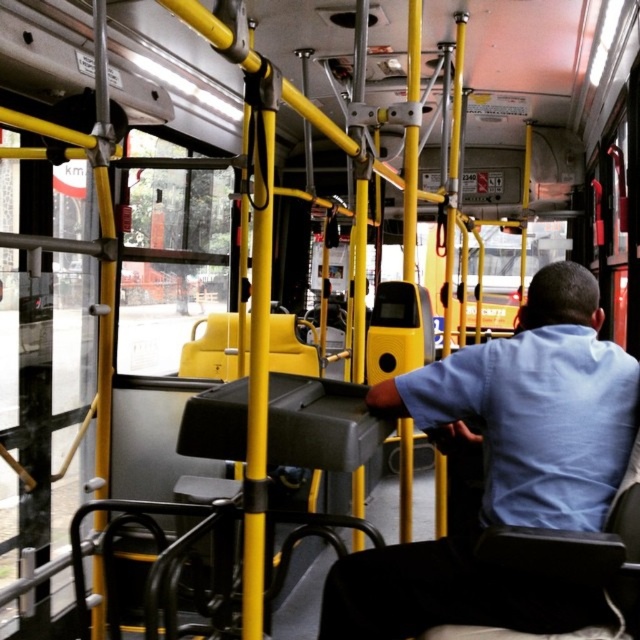
Question: Does blue cotton shirt at center appear on the right side of light blue cotton shirt at center?

Choices:
 (A) no
 (B) yes

Answer: (A)

Question: Is the position of blue cotton shirt at center more distant than that of light blue cotton shirt at center?

Choices:
 (A) no
 (B) yes

Answer: (A)

Question: Can you confirm if blue cotton shirt at center is positioned to the right of light blue cotton shirt at center?

Choices:
 (A) yes
 (B) no

Answer: (B)

Question: Which object appears farthest from the camera in this image?

Choices:
 (A) light blue cotton shirt at center
 (B) blue cotton shirt at center

Answer: (A)

Question: Among these points, which one is nearest to the camera?

Choices:
 (A) (570, 394)
 (B) (529, 387)

Answer: (A)